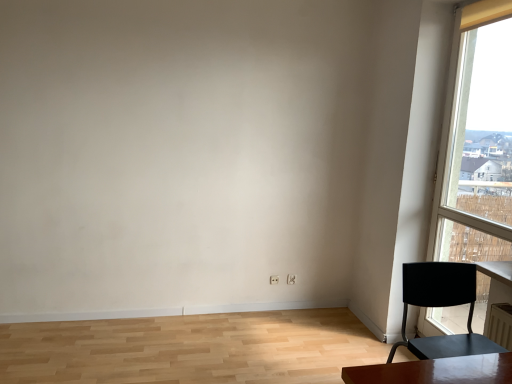
Question: From a real-world perspective, is transparent glass window at right below matte black chair at right?

Choices:
 (A) yes
 (B) no

Answer: (B)

Question: From the image's perspective, is transparent glass window at right over matte black chair at right?

Choices:
 (A) yes
 (B) no

Answer: (A)

Question: Is transparent glass window at right bigger than matte black chair at right?

Choices:
 (A) yes
 (B) no

Answer: (A)

Question: From the image's perspective, does transparent glass window at right appear lower than matte black chair at right?

Choices:
 (A) yes
 (B) no

Answer: (B)

Question: Can we say transparent glass window at right lies outside matte black chair at right?

Choices:
 (A) no
 (B) yes

Answer: (B)

Question: Is transparent glass window at right placed right next to matte black chair at right?

Choices:
 (A) no
 (B) yes

Answer: (A)

Question: Is matte black chair at right completely or partially outside of transparent glass window at right?

Choices:
 (A) yes
 (B) no

Answer: (A)

Question: Does matte black chair at right appear on the right side of transparent glass window at right?

Choices:
 (A) no
 (B) yes

Answer: (A)

Question: From a real-world perspective, is matte black chair at right over transparent glass window at right?

Choices:
 (A) yes
 (B) no

Answer: (B)

Question: From the image's perspective, is matte black chair at right located beneath transparent glass window at right?

Choices:
 (A) no
 (B) yes

Answer: (B)

Question: Considering the relative sizes of matte black chair at right and transparent glass window at right in the image provided, is matte black chair at right taller than transparent glass window at right?

Choices:
 (A) yes
 (B) no

Answer: (B)

Question: Is matte black chair at right thinner than transparent glass window at right?

Choices:
 (A) no
 (B) yes

Answer: (A)

Question: In the image, is matte black chair at right positioned in front of or behind transparent glass window at right?

Choices:
 (A) behind
 (B) front

Answer: (B)